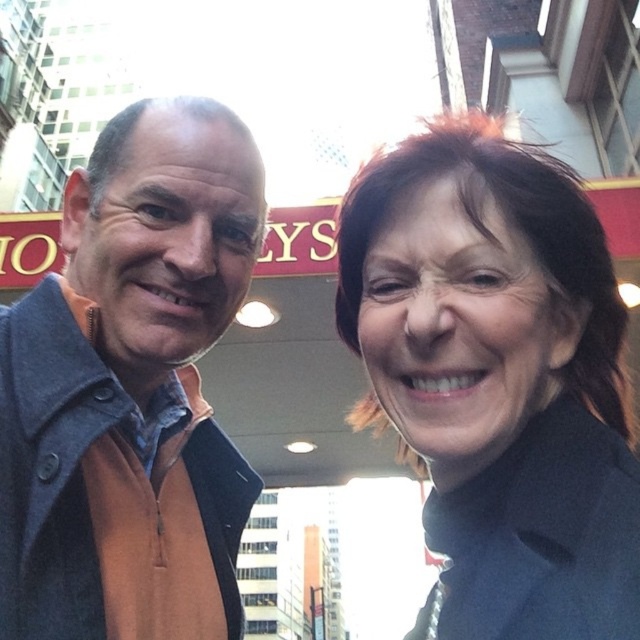
Question: Which point is closer to the camera?

Choices:
 (A) (616, 484)
 (B) (198, 260)

Answer: (A)

Question: Is orange fleece at left thinner than matte black coat at upper right?

Choices:
 (A) yes
 (B) no

Answer: (B)

Question: Is orange fleece at left in front of matte black coat at upper right?

Choices:
 (A) yes
 (B) no

Answer: (B)

Question: Can you confirm if orange fleece at left is thinner than matte black coat at upper right?

Choices:
 (A) yes
 (B) no

Answer: (B)